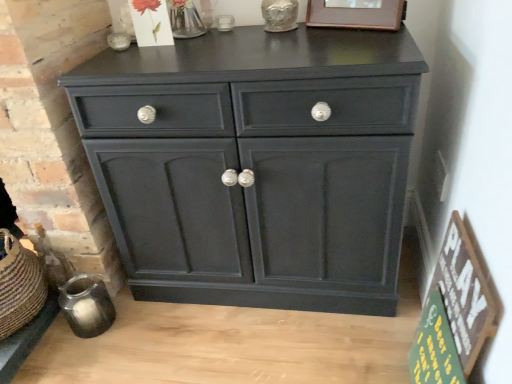
Question: From a real-world perspective, is green wood sign at lower right, positioned as the first bulletin board in bottom-to-top order, physically located above or below matte black cabinet at center?

Choices:
 (A) above
 (B) below

Answer: (B)

Question: Considering the positions of green wood sign at lower right, positioned as the first bulletin board in bottom-to-top order, and matte black cabinet at center in the image, is green wood sign at lower right, positioned as the first bulletin board in bottom-to-top order, wider or thinner than matte black cabinet at center?

Choices:
 (A) wide
 (B) thin

Answer: (B)

Question: Which object is the closest to the wooden picture frame at upper center?

Choices:
 (A) green wood sign at lower right, the 2th bulletin board viewed from the top
 (B) matte black cabinet at center
 (C) wooden sign at lower right, the 1th bulletin board viewed from the top

Answer: (B)

Question: Estimate the real-world distances between objects in this image. Which object is farther from the matte black cabinet at center?

Choices:
 (A) green wood sign at lower right, the 2th bulletin board viewed from the top
 (B) wooden picture frame at upper center
 (C) wooden sign at lower right, the 2th bulletin board in the bottom-to-top sequence

Answer: (A)